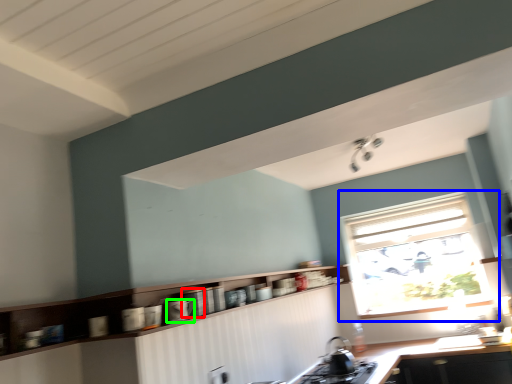
Question: Which object is the farthest from appliance (highlighted by a red box)? Choose among these: window (highlighted by a blue box) or appliance (highlighted by a green box).

Choices:
 (A) window
 (B) appliance

Answer: (A)